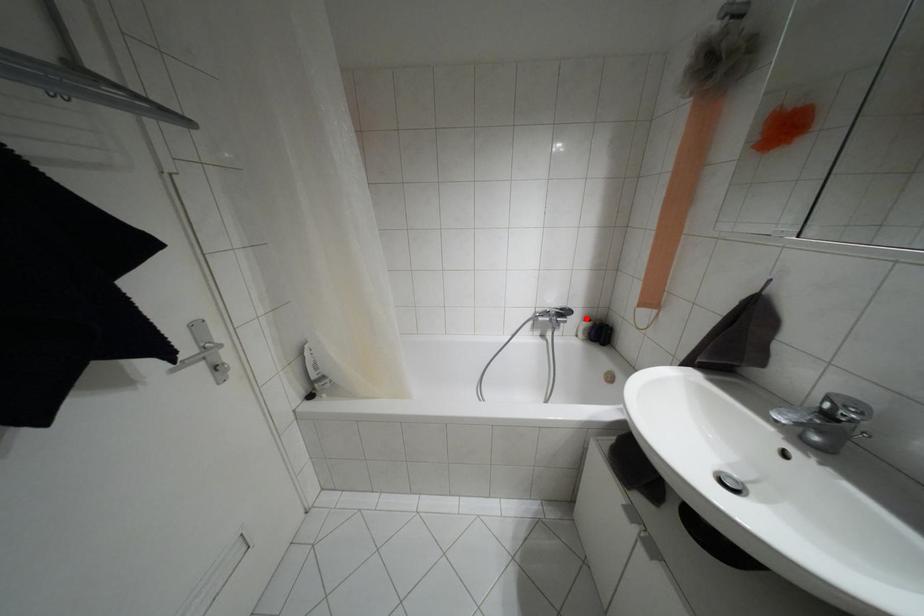
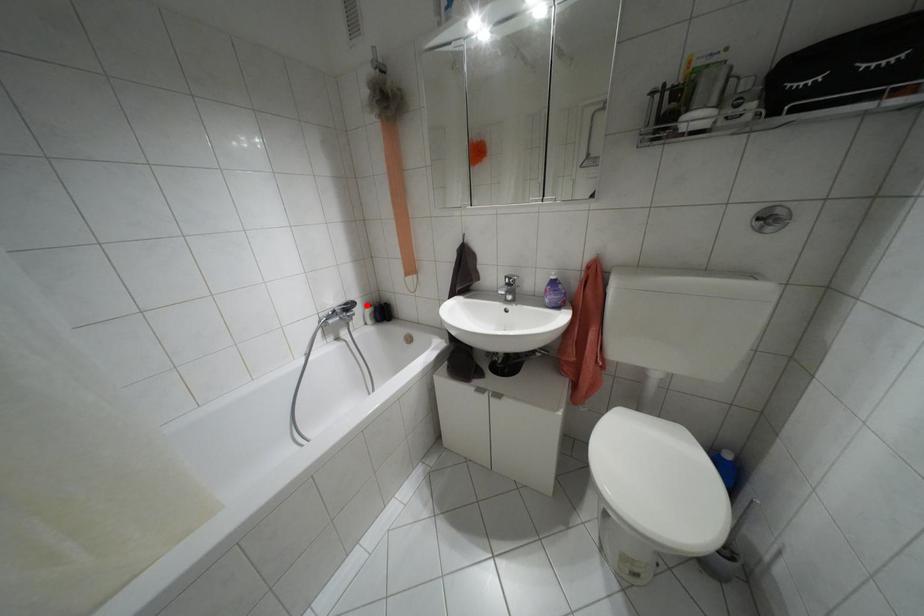
I am providing you with two images of the same scene from different viewpoints. A red point is marked on the first image and another point is marked on the second image. Do the highlighted points in image1 and image2 indicate the same real-world spot?

Yes